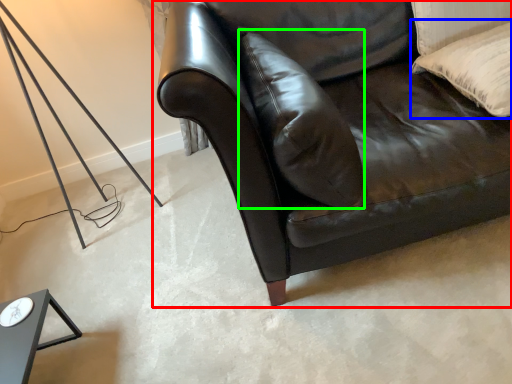
Question: Which is nearer to the studio couch (highlighted by a red box)? pillow (highlighted by a blue box) or pillow (highlighted by a green box).

Choices:
 (A) pillow
 (B) pillow

Answer: (B)